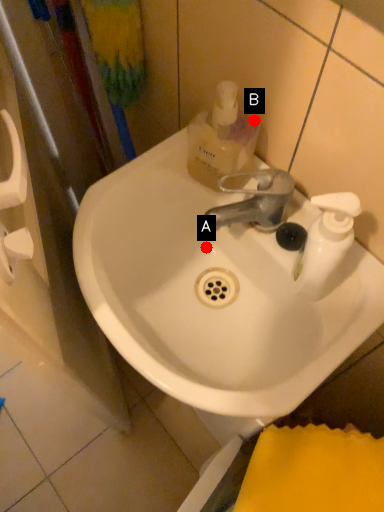
Question: Two points are circled on the image, labeled by A and B beside each circle. Which point appears farthest from the camera in this image?

Choices:
 (A) A is further
 (B) B is further

Answer: (A)